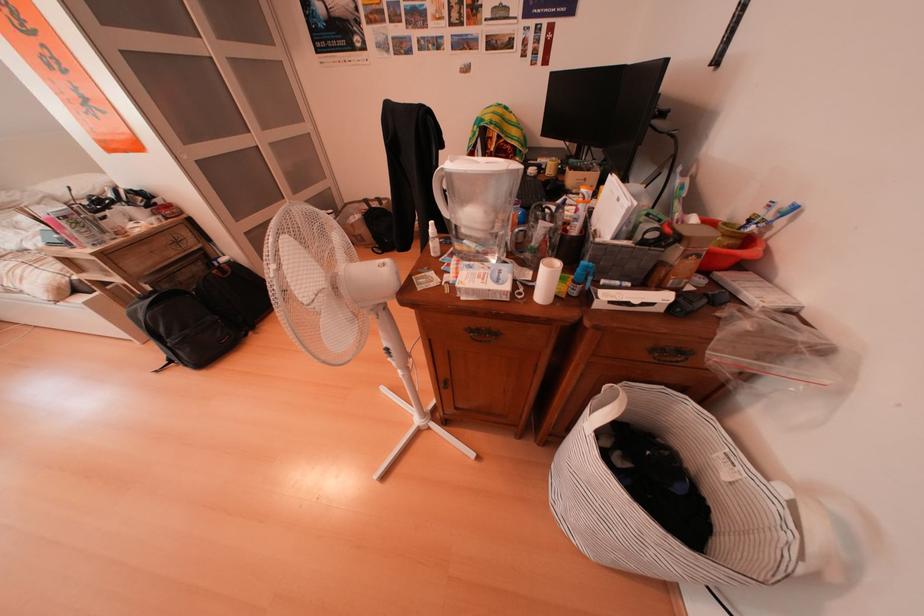
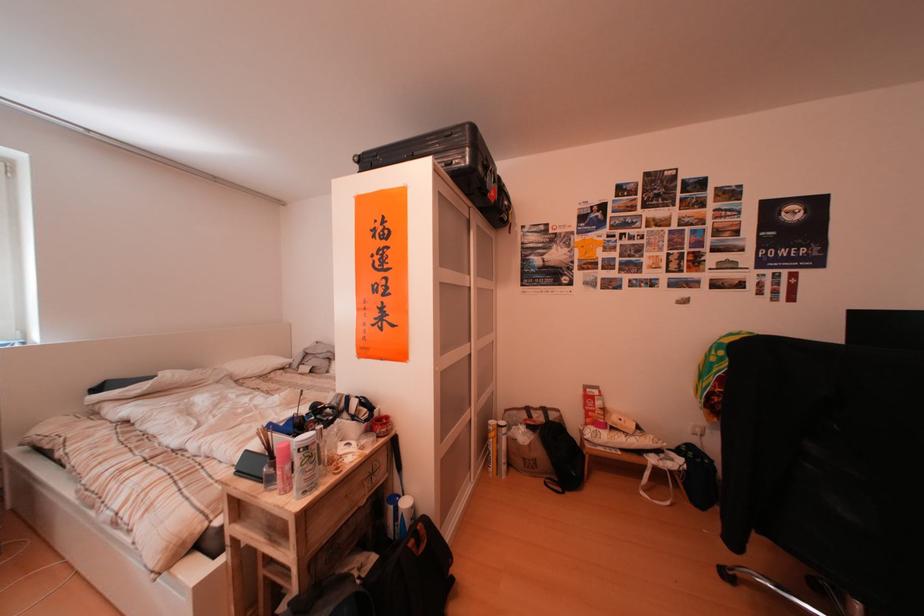
The point at (79,223) is marked in the first image. Where is the corresponding point in the second image?

(320, 453)